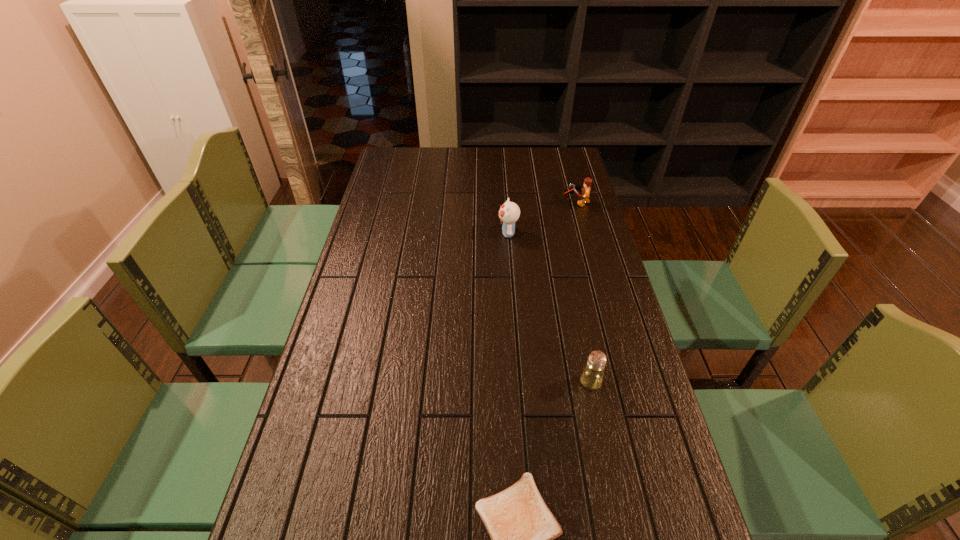
In order to click on blank space located 0.290m holding a crossbow in the hands of the rightmost object in this screenshot , I will do `click(489, 203)`.

The image size is (960, 540). I want to click on free point located 0.380m on the back of the third object from left to right, so click(x=568, y=273).

In order to click on Lego located at the right edge in this screenshot , I will do `click(585, 190)`.

At what (x,y) coordinates should I click in order to perform the action: click on saltshaker that is at the right edge. Please return your answer as a coordinate pair (x, y). This screenshot has width=960, height=540. Looking at the image, I should click on (592, 376).

Where is `free space at the far edge of the desktop`? The height and width of the screenshot is (540, 960). free space at the far edge of the desktop is located at coordinates (496, 154).

Find the location of a particular element. The height and width of the screenshot is (540, 960). free region at the left edge is located at coordinates (366, 293).

Locate an element on the screen. vacant region at the right edge of the desktop is located at coordinates (568, 219).

You are a GUI agent. You are given a task and a screenshot of the screen. Output one action in this format:
    pyautogui.click(x=<x>, y=<y>)
    Task: Click on the blank region between the kitten and the saltshaker
    The width and height of the screenshot is (960, 540).
    Given the screenshot: What is the action you would take?
    pyautogui.click(x=549, y=307)

Where is `vacant space that's between the second object from right to left and the farthest object`? The width and height of the screenshot is (960, 540). vacant space that's between the second object from right to left and the farthest object is located at coordinates (584, 292).

Find the location of a particular element. The image size is (960, 540). free point between the saltshaker and the farthest object is located at coordinates click(584, 292).